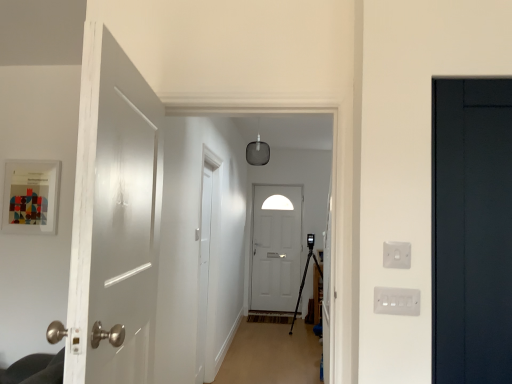
Question: Relative to white matte door at center, acting as the first door starting from the back, is white plastic switch at right, arranged as the 1th electric outlet when ordered from the bottom, in front or behind?

Choices:
 (A) behind
 (B) front

Answer: (B)

Question: From the image's perspective, is white plastic switch at right, arranged as the 1th electric outlet when ordered from the bottom, positioned above or below white matte door at center, which appears as the second door when viewed from the left?

Choices:
 (A) below
 (B) above

Answer: (B)

Question: Which object is the closest to the white glossy door at left, the first door when ordered from left to right?

Choices:
 (A) white plastic switch at right, arranged as the 1th electric outlet when ordered from the bottom
 (B) white plastic electric outlet at right, positioned as the 1th electric outlet in top-to-bottom order
 (C) wooden floor at center
 (D) dark wood door at right, the 2th door positioned from the back
 (E) white matte door at center, which appears as the 2th door when viewed from the right

Answer: (A)

Question: Based on their relative distances, which object is farther from the white matte door at center, which appears as the 2th door when viewed from the right?

Choices:
 (A) wooden floor at center
 (B) white glossy door at left, the 3th door viewed from the back
 (C) white plastic electric outlet at right, positioned as the 1th electric outlet in top-to-bottom order
 (D) white plastic switch at right, which is the 2th electric outlet from top to bottom
 (E) dark wood door at right, arranged as the 1th door when viewed from the right

Answer: (C)